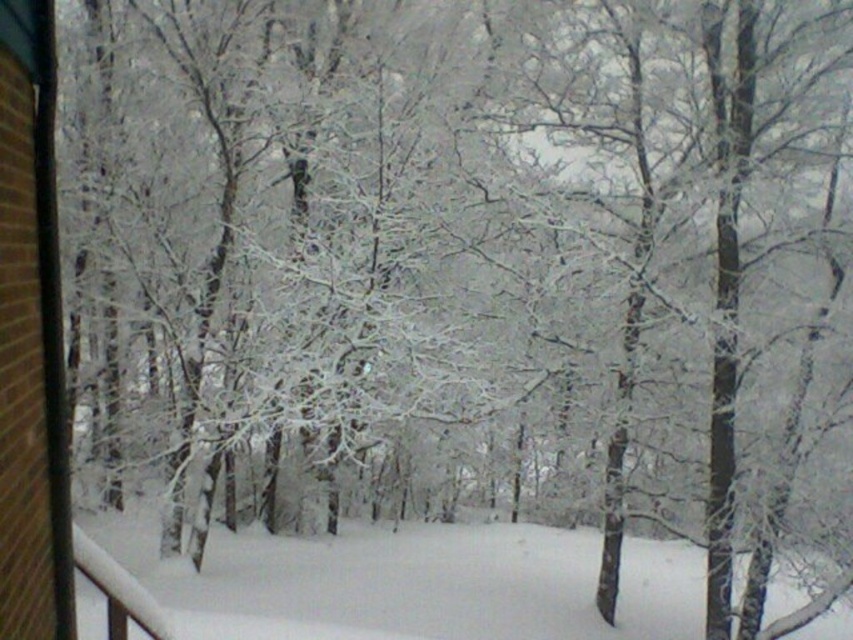
Can you confirm if white fluffy snow at center is positioned to the right of brown brick window at left?

Yes, white fluffy snow at center is to the right of brown brick window at left.

Who is shorter, white fluffy snow at center or brown brick window at left?

Standing shorter between the two is white fluffy snow at center.

Find the location of a particular element. The height and width of the screenshot is (640, 853). white fluffy snow at center is located at coordinates (415, 582).